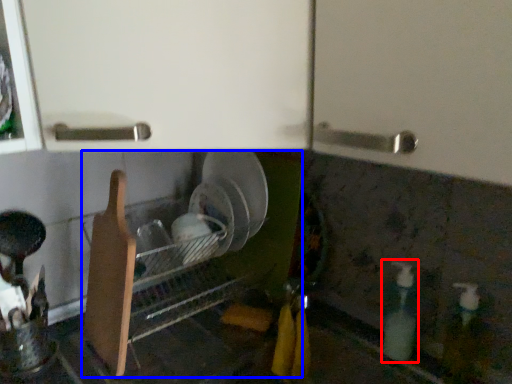
Question: Among these objects, which one is nearest to the camera, bottle (highlighted by a red box) or dish washer (highlighted by a blue box)?

Choices:
 (A) bottle
 (B) dish washer

Answer: (B)